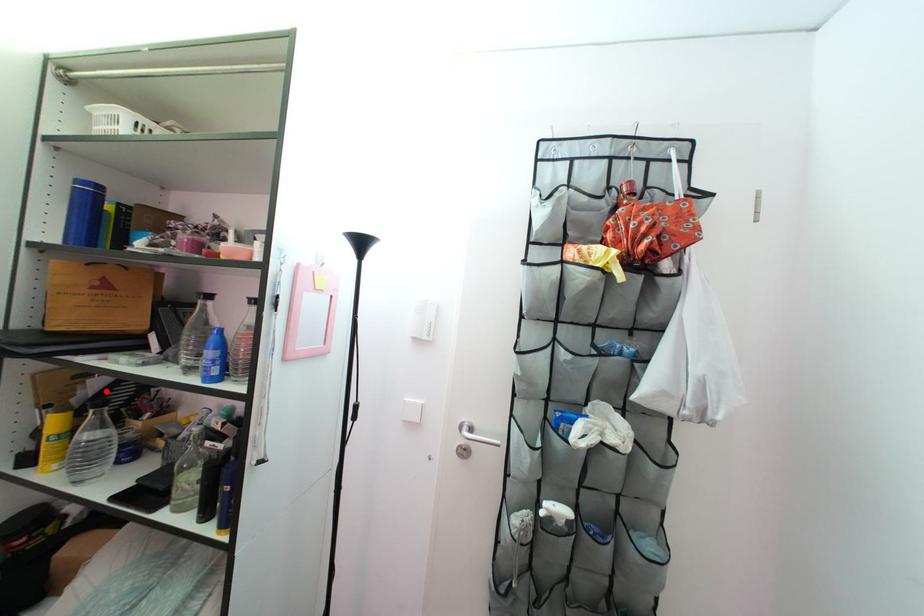
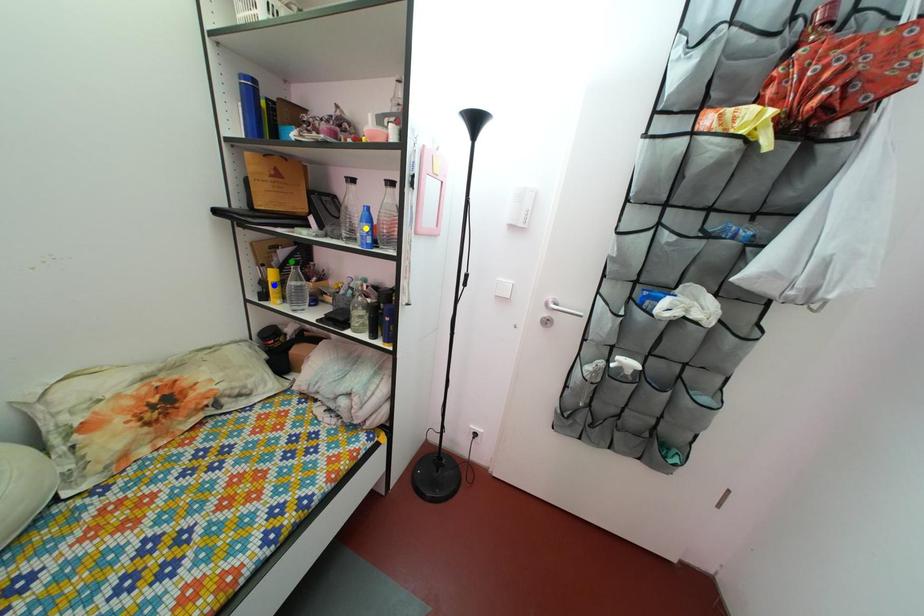
Question: I am providing you with two images of the same scene from different viewpoints. A red point is marked on the first image. You are given multiple points on the second image. Which point in image 2 represents the same 3d spot as the red point in image 1?

Choices:
 (A) green point
 (B) yellow point
 (C) blue point

Answer: (A)